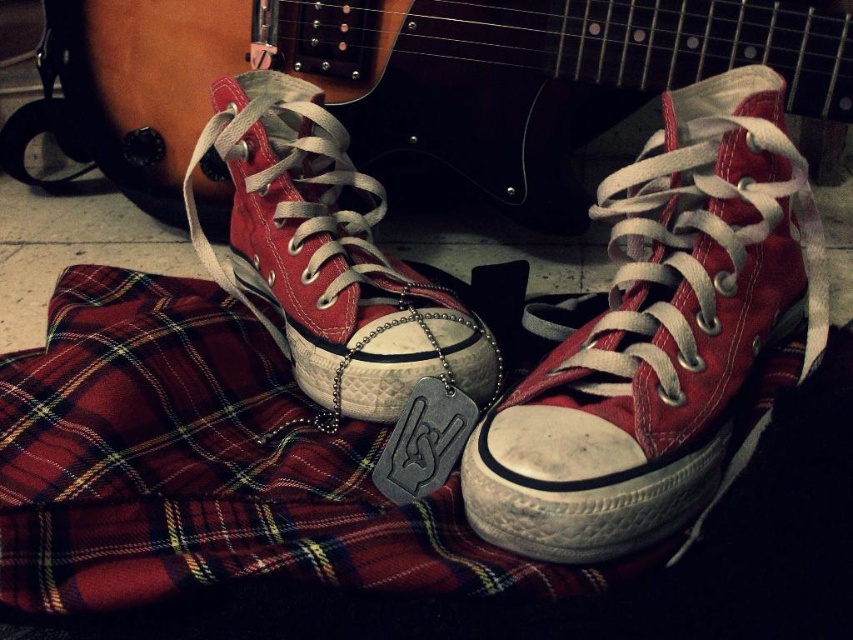
You are trying to decide which pair of shoes to wear with your outfit. You have a matte canvas sneaker at center and a matte canvas shoe at center. If you want to choose the smaller one, which one should you pick?

The matte canvas sneaker at center is smaller than the matte canvas shoe at center, so you should pick the matte canvas sneaker at center.

You are a shoemaker who needs to place both the matte canvas sneaker at center and the matte canvas shoe at center into a rectangular box. The box has a length of 12 inches. Can you fit both items side by side in the box without overlapping?

The matte canvas sneaker at center is 10.42 inches from the matte canvas shoe at center. Since the box is 12 inches long, the total distance between them is less than the box length. Therefore, they can be placed side by side in the box without overlapping.

You are a photographer setting up a shoot. You have a matte canvas sneaker at center and a matte canvas shoe at center in your setup. Which object is placed lower in the scene?

The matte canvas sneaker at center is positioned under the matte canvas shoe at center, so it is placed lower in the scene.